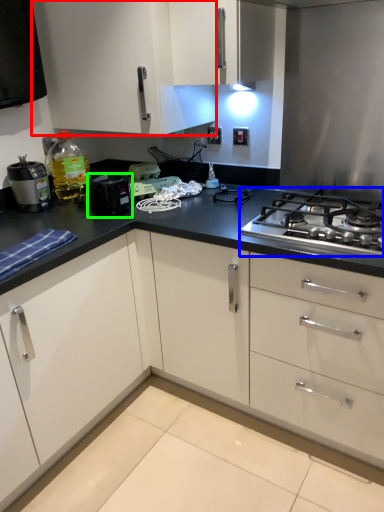
Question: Which object is positioned closest to cabinetry (highlighted by a red box)? Select from gas stove (highlighted by a blue box) and kitchen appliance (highlighted by a green box).

Choices:
 (A) gas stove
 (B) kitchen appliance

Answer: (B)